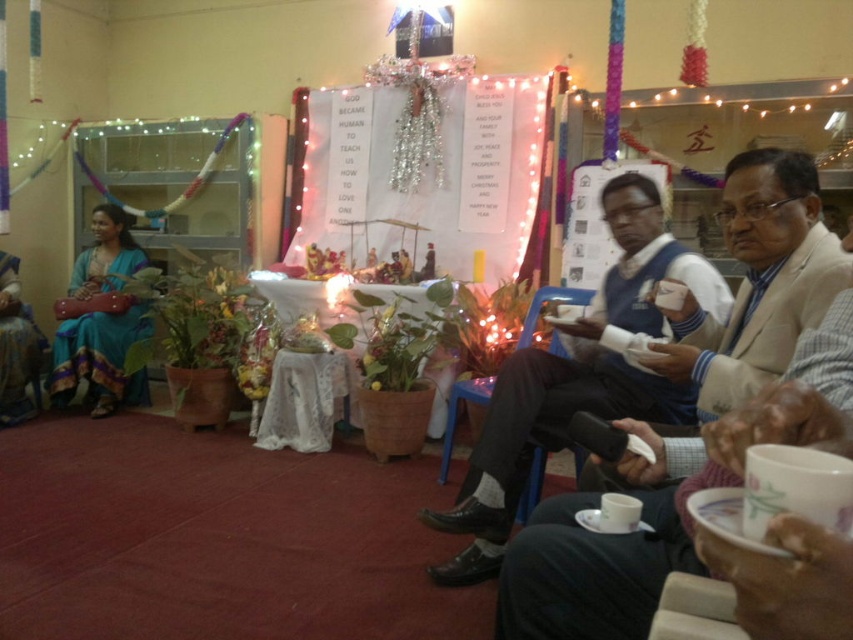
You are standing in the room and want to pick up the matte blue dress at left and the white plastic chair at lower right. Which object is closer to you?

The matte blue dress at left is closer to you because it is further to the viewer than the white plastic chair at lower right.

You are standing in the festive room and want to take a photo of both the light beige suit at right and the matte blue dress at left. Which one should you focus on first to ensure both are in clear view?

You should focus on the light beige suit at right first because it is closer to the viewer than the matte blue dress at left, ensuring both are in clear view when focused properly.